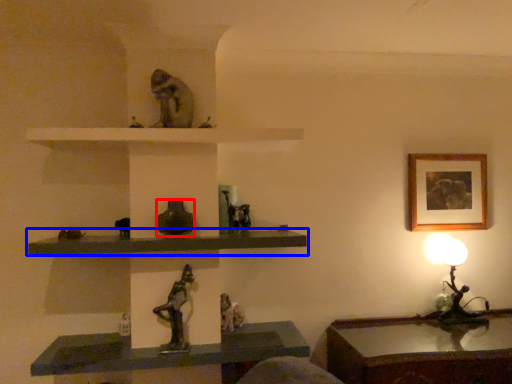
Question: Among these objects, which one is nearest to the camera, glass vase (highlighted by a red box) or shelf (highlighted by a blue box)?

Choices:
 (A) glass vase
 (B) shelf

Answer: (B)